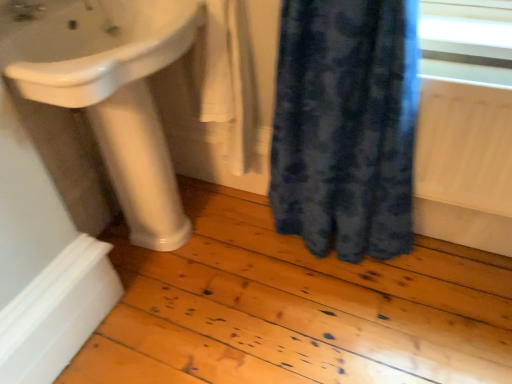
Question: Can you confirm if matte white tap at upper left is positioned to the right of white glossy pedestal at lower left?

Choices:
 (A) no
 (B) yes

Answer: (A)

Question: Is matte white tap at upper left looking in the opposite direction of white glossy pedestal at lower left?

Choices:
 (A) no
 (B) yes

Answer: (A)

Question: Could you tell me if matte white tap at upper left is turned towards white glossy pedestal at lower left?

Choices:
 (A) no
 (B) yes

Answer: (A)

Question: From a real-world perspective, is matte white tap at upper left beneath white glossy pedestal at lower left?

Choices:
 (A) yes
 (B) no

Answer: (B)

Question: Considering the relative sizes of matte white tap at upper left and white glossy pedestal at lower left in the image provided, is matte white tap at upper left smaller than white glossy pedestal at lower left?

Choices:
 (A) no
 (B) yes

Answer: (B)

Question: In terms of size, does matte white tap at upper left appear bigger or smaller than blue textured fabric at lower right?

Choices:
 (A) small
 (B) big

Answer: (A)

Question: Is point (24, 16) closer or farther from the camera than point (382, 160)?

Choices:
 (A) farther
 (B) closer

Answer: (B)

Question: Is matte white tap at upper left wider or thinner than blue textured fabric at lower right?

Choices:
 (A) wide
 (B) thin

Answer: (B)

Question: Choose the correct answer: Is matte white tap at upper left inside blue textured fabric at lower right or outside it?

Choices:
 (A) outside
 (B) inside

Answer: (A)

Question: Visually, is white glossy pedestal at lower left positioned to the left or to the right of white glossy sink at upper left?

Choices:
 (A) left
 (B) right

Answer: (A)

Question: From the image's perspective, is white glossy pedestal at lower left located above or below white glossy sink at upper left?

Choices:
 (A) above
 (B) below

Answer: (B)

Question: In terms of size, does white glossy pedestal at lower left appear bigger or smaller than white glossy sink at upper left?

Choices:
 (A) big
 (B) small

Answer: (B)

Question: From a real-world perspective, is white glossy pedestal at lower left positioned above or below white glossy sink at upper left?

Choices:
 (A) below
 (B) above

Answer: (A)

Question: Considering the positions of blue textured fabric at lower right and white cotton towel at center in the image, is blue textured fabric at lower right wider or thinner than white cotton towel at center?

Choices:
 (A) thin
 (B) wide

Answer: (B)

Question: From the image's perspective, is blue textured fabric at lower right positioned above or below white cotton towel at center?

Choices:
 (A) above
 (B) below

Answer: (B)